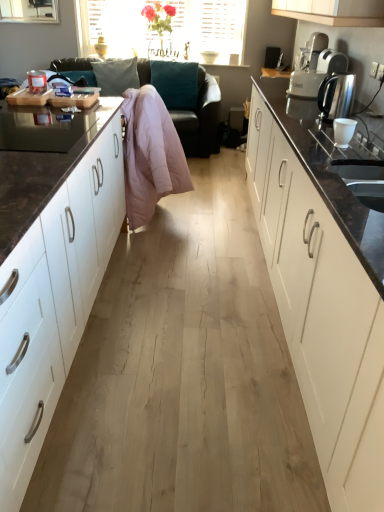
How much space does white matte cabinet at left, placed as the 1th cabinetry when sorted from left to right, occupy horizontally?

white matte cabinet at left, placed as the 1th cabinetry when sorted from left to right, is 34.32 inches wide.

The width and height of the screenshot is (384, 512). I want to click on satin silver kettle at right, so click(336, 96).

This screenshot has width=384, height=512. What do you see at coordinates (336, 96) in the screenshot? I see `satin silver kettle at right` at bounding box center [336, 96].

The image size is (384, 512). What are the coordinates of `white glossy cabinet at right, the 2th cabinetry in the left-to-right sequence` in the screenshot? It's located at (320, 307).

At what (x,y) coordinates should I click in order to perform the action: click on transparent glass window at upper left. Please return your answer as a coordinate pair (x, y). Looking at the image, I should click on (29, 11).

Describe the element at coordinates (29, 11) in the screenshot. I see `transparent glass window at upper left` at that location.

Locate an element on the screen. white matte cabinet at left, placed as the 1th cabinetry when sorted from left to right is located at coordinates (51, 277).

Is translucent glass vase at upper center at the left side of satin silver kettle at right?

Indeed, translucent glass vase at upper center is positioned on the left side of satin silver kettle at right.

Looking at this image, which is farther, (x=227, y=14) or (x=337, y=92)?

Point (x=227, y=14)

Can you confirm if translucent glass vase at upper center is shorter than satin silver kettle at right?

No, translucent glass vase at upper center is not shorter than satin silver kettle at right.

Is translucent glass vase at upper center aimed at satin silver kettle at right?

Yes, translucent glass vase at upper center is facing satin silver kettle at right.

Choose the correct answer: Is translucent glass vase at upper center inside white matte cabinet at left, which ranks as the 2th cabinetry in right-to-left order, or outside it?

translucent glass vase at upper center cannot be found inside white matte cabinet at left, which ranks as the 2th cabinetry in right-to-left order.

You are a GUI agent. You are given a task and a screenshot of the screen. Output one action in this format:
    pyautogui.click(x=<x>, y=<y>)
    Task: Click on the window screen that appears above the white matte cabinet at left, which ranks as the 2th cabinetry in right-to-left order (from the image's perspective)
    
    Given the screenshot: What is the action you would take?
    pyautogui.click(x=207, y=30)

Which is behind, point (227, 10) or point (41, 422)?

Positioned behind is point (227, 10).

From the image's perspective, is translucent glass vase at upper center under white matte cabinet at left, placed as the 1th cabinetry when sorted from left to right?

Actually, translucent glass vase at upper center appears above white matte cabinet at left, placed as the 1th cabinetry when sorted from left to right, in the image.

Where is `the 1st cabinetry below the pink down jacket at center (from the image's perspective)`? Image resolution: width=384 pixels, height=512 pixels. the 1st cabinetry below the pink down jacket at center (from the image's perspective) is located at coordinates (320, 307).

Considering the positions of points (177, 145) and (308, 337), is point (177, 145) closer to camera compared to point (308, 337)?

No, (177, 145) is further to viewer.

Is white glossy cabinet at right, marked as the first cabinetry in a right-to-left arrangement, surrounded by pink down jacket at center?

No, white glossy cabinet at right, marked as the first cabinetry in a right-to-left arrangement, is located outside of pink down jacket at center.

From the image's perspective, is white matte cabinet at left, which ranks as the 2th cabinetry in right-to-left order, above teal fabric pillow at upper center?

Actually, white matte cabinet at left, which ranks as the 2th cabinetry in right-to-left order, appears below teal fabric pillow at upper center in the image.

Is white matte cabinet at left, placed as the 1th cabinetry when sorted from left to right, positioned with its back to teal fabric pillow at upper center?

white matte cabinet at left, placed as the 1th cabinetry when sorted from left to right, does not have its back to teal fabric pillow at upper center.

Considering the sizes of objects white matte cabinet at left, which ranks as the 2th cabinetry in right-to-left order, and teal fabric pillow at upper center in the image provided, who is bigger, white matte cabinet at left, which ranks as the 2th cabinetry in right-to-left order, or teal fabric pillow at upper center?

white matte cabinet at left, which ranks as the 2th cabinetry in right-to-left order.

Which is in front, white matte cabinet at left, which ranks as the 2th cabinetry in right-to-left order, or teal fabric pillow at upper center?

white matte cabinet at left, which ranks as the 2th cabinetry in right-to-left order, is in front.

In the scene shown: Is pink down jacket at center oriented towards white plastic toaster at upper right?

No, pink down jacket at center is not facing towards white plastic toaster at upper right.

Is pink down jacket at center next to white plastic toaster at upper right?

No, pink down jacket at center is not with white plastic toaster at upper right.

From a real-world perspective, is pink down jacket at center under white plastic toaster at upper right?

Yes, from a real-world perspective, pink down jacket at center is below white plastic toaster at upper right.

Does point (125, 187) come closer to viewer compared to point (335, 55)?

Yes, point (125, 187) is closer to viewer.

Is teal fabric pillow at upper center at the back of pink fabric couch at center?

Yes, pink fabric couch at center's orientation is away from teal fabric pillow at upper center.

Based on the photo, would you consider pink fabric couch at center to be distant from teal fabric pillow at upper center?

No, pink fabric couch at center is not far away from teal fabric pillow at upper center.

From the picture: Is pink fabric couch at center completely or partially outside of teal fabric pillow at upper center?

Indeed, pink fabric couch at center is completely outside teal fabric pillow at upper center.

Which point is more distant from viewer, (208, 96) or (185, 71)?

Positioned behind is point (185, 71).

Can you confirm if white glossy cabinet at right, the 2th cabinetry in the left-to-right sequence, is wider than transparent glass window at upper left?

Yes.

Between point (326, 261) and point (53, 7), which one is positioned in front?

The point (326, 261) is more forward.

Considering the sizes of objects white glossy cabinet at right, marked as the first cabinetry in a right-to-left arrangement, and transparent glass window at upper left in the image provided, who is taller, white glossy cabinet at right, marked as the first cabinetry in a right-to-left arrangement, or transparent glass window at upper left?

Standing taller between the two is white glossy cabinet at right, marked as the first cabinetry in a right-to-left arrangement.

Is white glossy cabinet at right, marked as the first cabinetry in a right-to-left arrangement, turned away from transparent glass window at upper left?

white glossy cabinet at right, marked as the first cabinetry in a right-to-left arrangement, does not have its back to transparent glass window at upper left.

This screenshot has width=384, height=512. Identify the location of window screen on the left of satin silver kettle at right. (207, 30).

The image size is (384, 512). I want to click on window screen above the white matte cabinet at left, placed as the 1th cabinetry when sorted from left to right (from the image's perspective), so click(207, 30).

From the image, which object appears to be nearer to pink down jacket at center, pink fabric couch at center or translucent glass vase at upper center?

pink fabric couch at center is positioned closer to the anchor pink down jacket at center.

Based on their spatial positions, is white plastic toaster at upper right or translucent glass vase at upper center closer to white glossy cabinet at right, the 2th cabinetry in the left-to-right sequence?

white plastic toaster at upper right is positioned closer to the anchor white glossy cabinet at right, the 2th cabinetry in the left-to-right sequence.

From the image, which object appears to be farther from pink fabric couch at center, satin silver kettle at right or translucent glass vase at upper center?

Among the two, satin silver kettle at right is located further to pink fabric couch at center.

Which object lies further to the anchor point satin silver kettle at right, white glossy cabinet at right, marked as the first cabinetry in a right-to-left arrangement, or pink fabric couch at center?

pink fabric couch at center.

When comparing their distances from teal fabric pillow at upper center, does white glossy cabinet at right, the 2th cabinetry in the left-to-right sequence, or white plastic toaster at upper right seem further?

Among the two, white glossy cabinet at right, the 2th cabinetry in the left-to-right sequence, is located further to teal fabric pillow at upper center.

Consider the image. Looking at the image, which one is located further to white glossy cabinet at right, marked as the first cabinetry in a right-to-left arrangement, transparent glass window at upper left or teal fabric pillow at upper center?

transparent glass window at upper left lies further to white glossy cabinet at right, marked as the first cabinetry in a right-to-left arrangement, than the other object.

Considering their positions, is transparent glass window at upper left positioned closer to white matte cabinet at left, which ranks as the 2th cabinetry in right-to-left order, than teal fabric pillow at upper center?

teal fabric pillow at upper center.

Considering their positions, is teal fabric pillow at upper center positioned further to white plastic toaster at upper right than pink down jacket at center?

teal fabric pillow at upper center lies further to white plastic toaster at upper right than the other object.

Where is `pillow located between white plastic toaster at upper right and translucent glass vase at upper center in the depth direction`? The width and height of the screenshot is (384, 512). pillow located between white plastic toaster at upper right and translucent glass vase at upper center in the depth direction is located at coordinates (176, 83).

Identify the location of studio couch between pink down jacket at center and teal fabric pillow at upper center from front to back. (200, 119).

Find the location of a particular element. Image resolution: width=384 pixels, height=512 pixels. kitchen appliance situated between pink down jacket at center and white plastic toaster at upper right from left to right is located at coordinates (336, 96).

This screenshot has height=512, width=384. I want to click on pillow between white glossy cabinet at right, the 2th cabinetry in the left-to-right sequence, and transparent glass window at upper left, along the z-axis, so click(x=176, y=83).